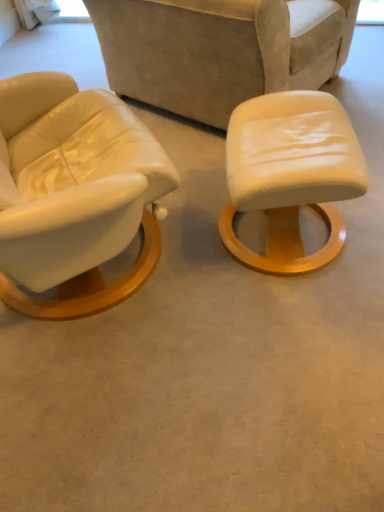
Locate an element on the screen. The width and height of the screenshot is (384, 512). free space in front of matte white stool at center is located at coordinates (285, 329).